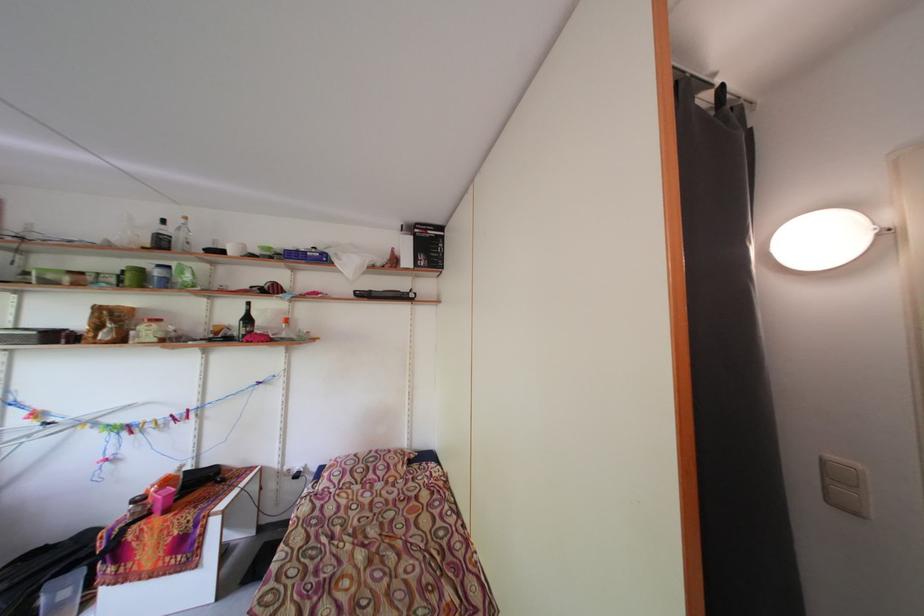
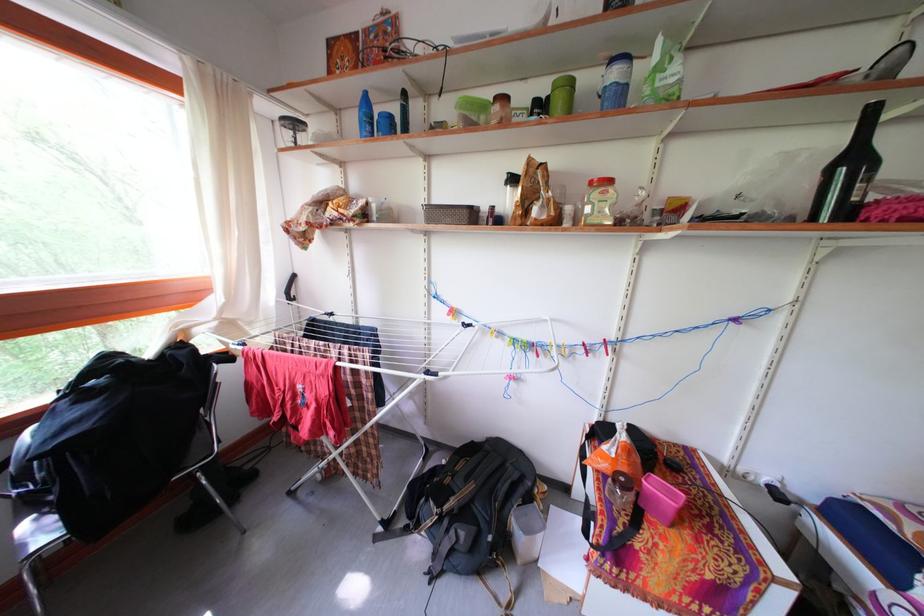
Find the pixel in the second image that matches point (256, 325) in the first image.

(861, 166)